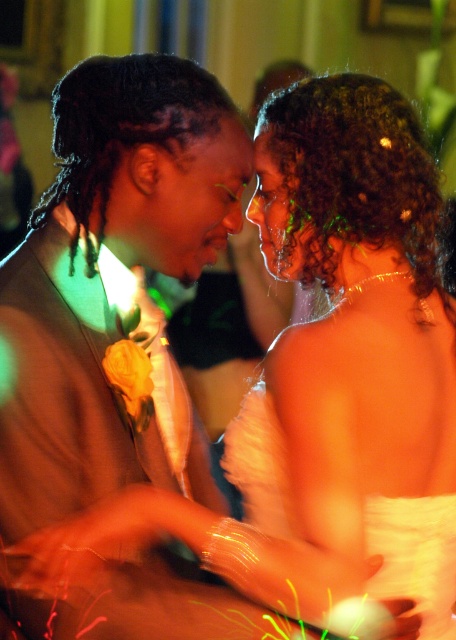
Question: Which point is closer to the camera?

Choices:
 (A) white satin dress at center
 (B) matte brown suit at left

Answer: (B)

Question: Does white satin dress at center have a lesser width compared to matte brown suit at left?

Choices:
 (A) yes
 (B) no

Answer: (B)

Question: Can you confirm if white satin dress at center is bigger than matte brown suit at left?

Choices:
 (A) no
 (B) yes

Answer: (A)

Question: Is white satin dress at center below matte brown suit at left?

Choices:
 (A) no
 (B) yes

Answer: (B)